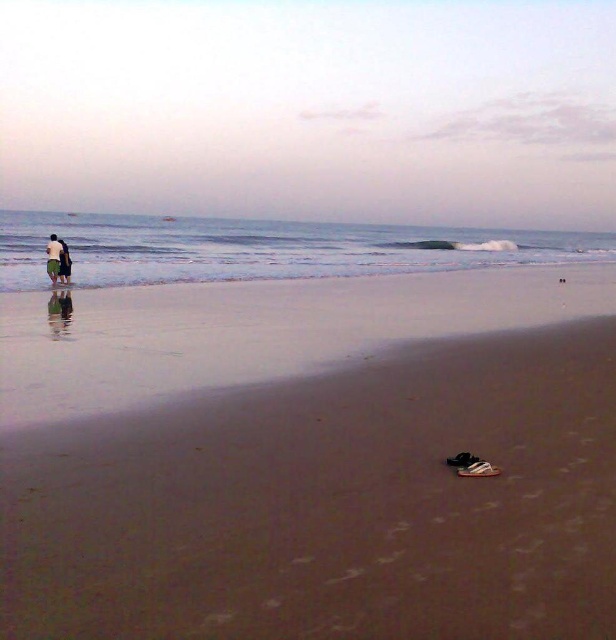
Looking at this image, is brown sand at lower center positioned at the back of white cotton shirt at left?

No, it is not.

Between point (387, 312) and point (65, 257), which one is positioned behind?

The point (65, 257) is more distant.

Image resolution: width=616 pixels, height=640 pixels. Identify the location of brown sand at lower center. (310, 458).

Is point (472, 273) closer to viewer compared to point (150, 244)?

Yes.

Is point (575, 412) positioned behind point (330, 234)?

No, (575, 412) is closer to viewer.

The width and height of the screenshot is (616, 640). Identify the location of brown sand at lower center. (310, 458).

Is brown sand at lower center wider than dark green shorts at left?

Yes, brown sand at lower center is wider than dark green shorts at left.

Can you confirm if brown sand at lower center is positioned above dark green shorts at left?

No.

What are the coordinates of `brown sand at lower center` in the screenshot? It's located at (310, 458).

Find the location of `brown sand at lower center`. brown sand at lower center is located at coordinates click(310, 458).